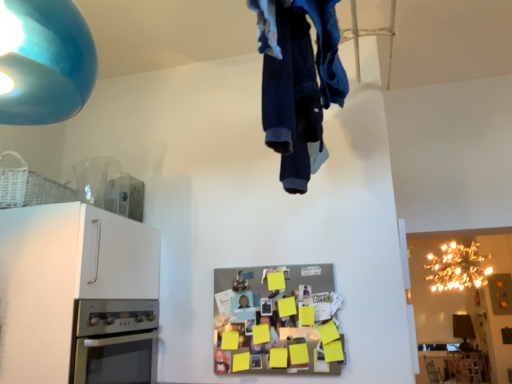
Question: From the image's perspective, would you say matte blue lampshade at upper left, the first lamp in the top-to-bottom sequence, is shown under stainless steel oven at lower left?

Choices:
 (A) yes
 (B) no

Answer: (B)

Question: Considering the relative positions of matte blue lampshade at upper left, acting as the second lamp starting from the right, and stainless steel oven at lower left in the image provided, is matte blue lampshade at upper left, acting as the second lamp starting from the right, behind stainless steel oven at lower left?

Choices:
 (A) no
 (B) yes

Answer: (A)

Question: Can you confirm if matte blue lampshade at upper left, the second lamp from the bottom, is positioned to the right of stainless steel oven at lower left?

Choices:
 (A) no
 (B) yes

Answer: (B)

Question: Considering the relative sizes of matte blue lampshade at upper left, the second lamp from the bottom, and stainless steel oven at lower left in the image provided, is matte blue lampshade at upper left, the second lamp from the bottom, wider than stainless steel oven at lower left?

Choices:
 (A) yes
 (B) no

Answer: (B)

Question: Is matte blue lampshade at upper left, the first lamp in the top-to-bottom sequence, bigger than stainless steel oven at lower left?

Choices:
 (A) no
 (B) yes

Answer: (A)

Question: Considering the relative sizes of matte blue lampshade at upper left, the first lamp in the top-to-bottom sequence, and stainless steel oven at lower left in the image provided, is matte blue lampshade at upper left, the first lamp in the top-to-bottom sequence, thinner than stainless steel oven at lower left?

Choices:
 (A) yes
 (B) no

Answer: (A)

Question: Is white matte cabinet at left shorter than denim fabric pants at upper center?

Choices:
 (A) yes
 (B) no

Answer: (B)

Question: Does white matte cabinet at left have a larger size compared to denim fabric pants at upper center?

Choices:
 (A) yes
 (B) no

Answer: (A)

Question: Can you confirm if white matte cabinet at left is positioned to the left of denim fabric pants at upper center?

Choices:
 (A) yes
 (B) no

Answer: (A)

Question: Is white matte cabinet at left facing towards denim fabric pants at upper center?

Choices:
 (A) yes
 (B) no

Answer: (A)

Question: Is white matte cabinet at left to the right of denim fabric pants at upper center from the viewer's perspective?

Choices:
 (A) no
 (B) yes

Answer: (A)

Question: Considering the relative sizes of white matte cabinet at left and denim fabric pants at upper center in the image provided, is white matte cabinet at left thinner than denim fabric pants at upper center?

Choices:
 (A) no
 (B) yes

Answer: (A)

Question: Does matte blue lampshade at upper left, the second lamp in the back-to-front sequence, appear on the right side of denim fabric pants at upper center?

Choices:
 (A) no
 (B) yes

Answer: (A)